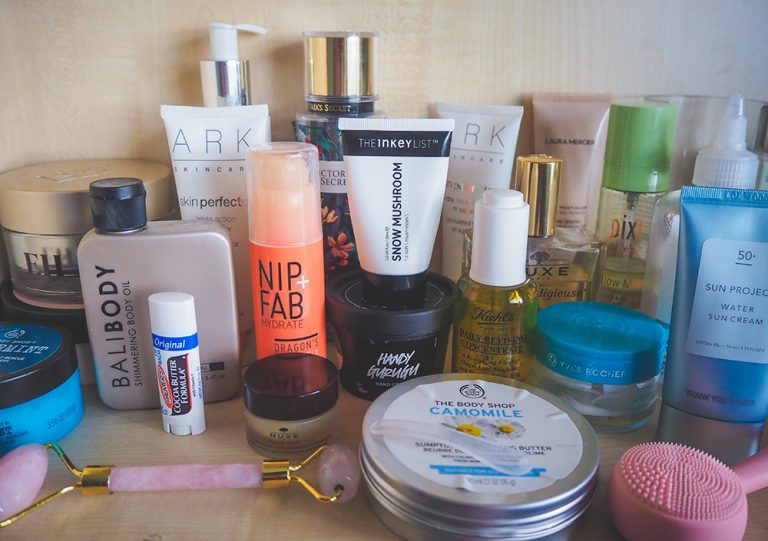
Image resolution: width=768 pixels, height=541 pixels. In order to click on counter or table brown light in this screenshot , I will do `click(220, 511)`.